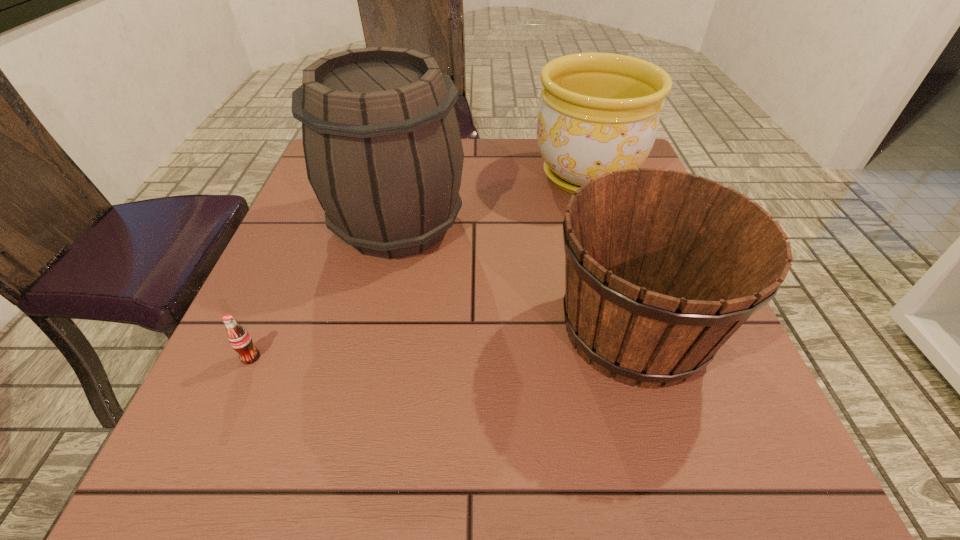
Locate an element on the screen. vacant space at the left edge is located at coordinates (261, 299).

Locate an element on the screen. vacant space at the right edge of the desktop is located at coordinates (693, 428).

Find the location of a particular element. The width and height of the screenshot is (960, 540). vacant space at the near right corner of the desktop is located at coordinates (757, 500).

At what (x,y) coordinates should I click in order to perform the action: click on vacant area that lies between the flowerpot and the left wine bucket. Please return your answer as a coordinate pair (x, y). The width and height of the screenshot is (960, 540). Looking at the image, I should click on coord(492,200).

Identify the location of unoccupied area between the tallest object and the flowerpot. The image size is (960, 540). (492, 200).

I want to click on vacant space in between the left wine bucket and the shortest object, so click(324, 291).

This screenshot has height=540, width=960. I want to click on free space between the tallest object and the leftmost object, so click(324, 291).

The image size is (960, 540). I want to click on vacant space that's between the leftmost object and the shorter wine bucket, so click(443, 343).

Identify the location of free space between the second object from left to right and the leftmost object. (324, 291).

You are a GUI agent. You are given a task and a screenshot of the screen. Output one action in this format:
    pyautogui.click(x=<x>, y=<y>)
    Task: Click on the empty location between the tallest object and the leftmost object
    The width and height of the screenshot is (960, 540).
    Given the screenshot: What is the action you would take?
    pyautogui.click(x=324, y=291)